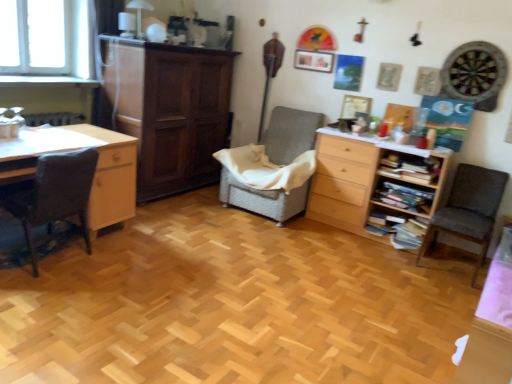
Where is `free region under dark gray fabric chair at right, the first chair from the right (from a real-world perspective)`? This screenshot has height=384, width=512. free region under dark gray fabric chair at right, the first chair from the right (from a real-world perspective) is located at coordinates (451, 263).